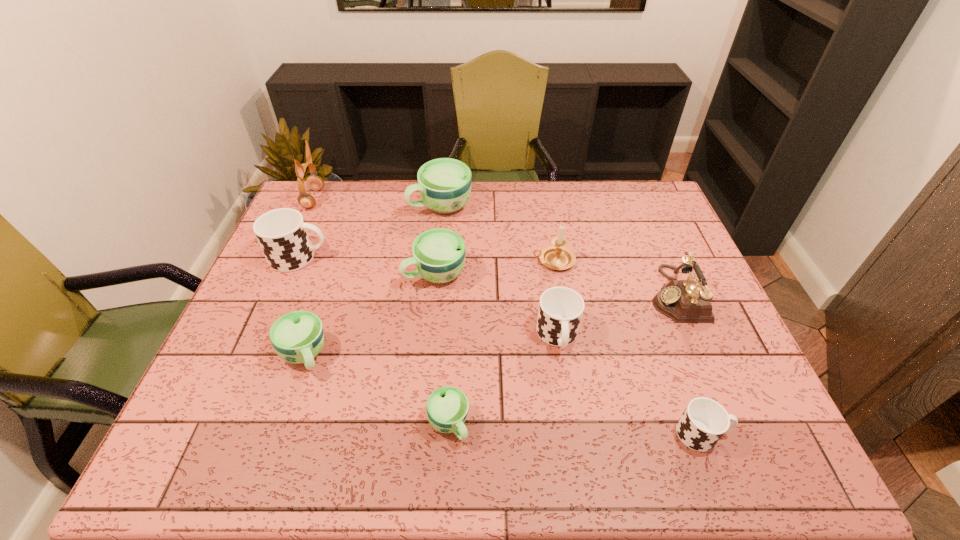
Where is `free spot located 0.210m on the back of the smallest blue cup`? The height and width of the screenshot is (540, 960). free spot located 0.210m on the back of the smallest blue cup is located at coordinates (454, 328).

The height and width of the screenshot is (540, 960). In order to click on earphone located at the far edge in this screenshot , I will do `click(315, 183)`.

Where is `cup present at the far edge`? cup present at the far edge is located at coordinates (444, 184).

The image size is (960, 540). In order to click on earphone that is at the left edge in this screenshot , I will do `click(315, 183)`.

Identify the location of telephone that is at the right edge. (684, 301).

Find the location of `cup that is at the right edge`. cup that is at the right edge is located at coordinates (704, 421).

You are a GUI agent. You are given a task and a screenshot of the screen. Output one action in this format:
    pyautogui.click(x=<x>, y=<y>)
    Task: Click on the object located at the far left corner
    
    Given the screenshot: What is the action you would take?
    pyautogui.click(x=315, y=183)

The width and height of the screenshot is (960, 540). Identify the location of object at the near right corner. (704, 421).

In the image, there is a desktop. At what (x,y) coordinates should I click in order to perform the action: click on vacant space at the far edge. Please return your answer as a coordinate pair (x, y). The height and width of the screenshot is (540, 960). Looking at the image, I should click on pyautogui.click(x=358, y=183).

The image size is (960, 540). Find the location of `free location at the near edge of the desktop`. free location at the near edge of the desktop is located at coordinates (319, 433).